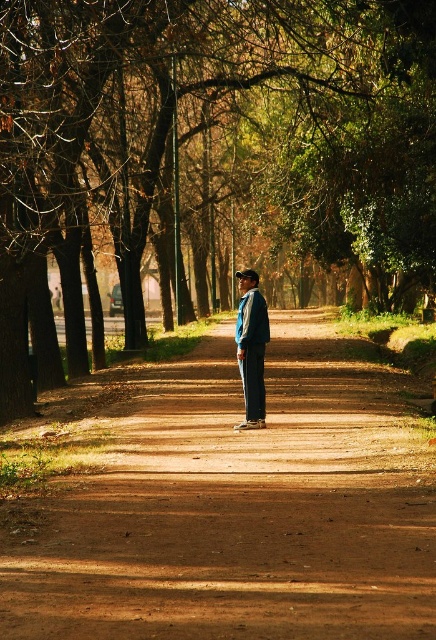
Question: Estimate the real-world distances between objects in this image. Which object is closer to the brown bark tree at center?

Choices:
 (A) denim jacket at center
 (B) dirt road at center

Answer: (B)

Question: Which of the following is the closest to the observer?

Choices:
 (A) denim jacket at center
 (B) dirt road at center

Answer: (B)

Question: Is brown bark tree at center to the right of dirt road at center from the viewer's perspective?

Choices:
 (A) yes
 (B) no

Answer: (A)

Question: Is brown bark tree at center wider than dirt road at center?

Choices:
 (A) yes
 (B) no

Answer: (A)

Question: Which point is closer to the camera taking this photo?

Choices:
 (A) (252, 360)
 (B) (415, 29)

Answer: (A)

Question: Can you confirm if dirt road at center is wider than denim jacket at center?

Choices:
 (A) no
 (B) yes

Answer: (B)